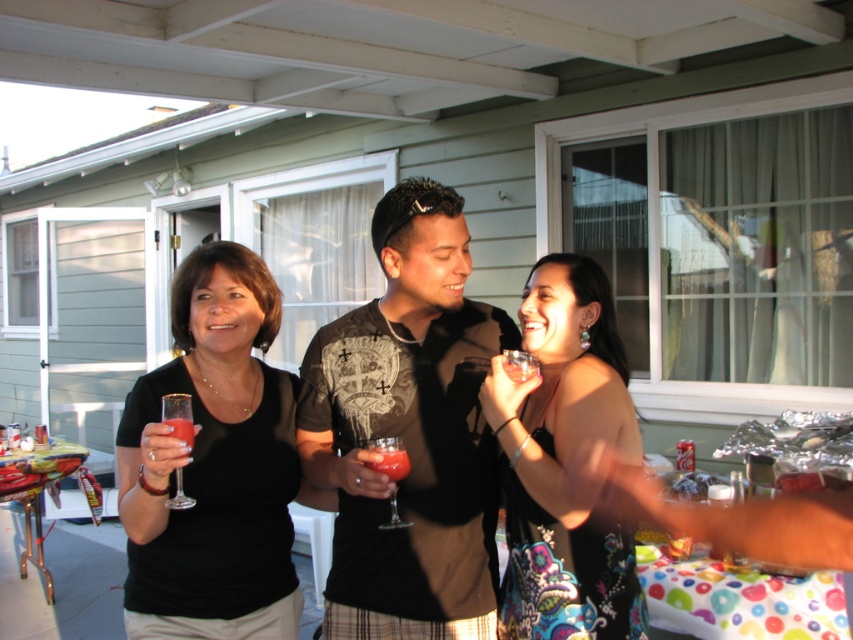
Where is `black matte dress at center`? Image resolution: width=853 pixels, height=640 pixels. black matte dress at center is located at coordinates (213, 465).

Can you confirm if black matte dress at center is taller than matte glass at left?

Correct, black matte dress at center is much taller as matte glass at left.

Does point (157, 454) lie in front of point (183, 420)?

Yes.

The height and width of the screenshot is (640, 853). Identify the location of black matte dress at center. (213, 465).

Which is in front, point (289, 388) or point (535, 561)?

Point (535, 561)

Which of these two, black matte dress at center or shiny black dress at center, stands taller?

black matte dress at center is taller.

At what (x,y) coordinates should I click in order to perform the action: click on black matte dress at center. Please return your answer as a coordinate pair (x, y). The image size is (853, 640). Looking at the image, I should click on (213, 465).

Where is `black matte dress at center`? black matte dress at center is located at coordinates (213, 465).

Is shiny black dress at center thinner than matte glass at left?

In fact, shiny black dress at center might be wider than matte glass at left.

Describe the element at coordinates (564, 460) in the screenshot. The image size is (853, 640). I see `shiny black dress at center` at that location.

Where is `shiny black dress at center`? This screenshot has height=640, width=853. shiny black dress at center is located at coordinates (564, 460).